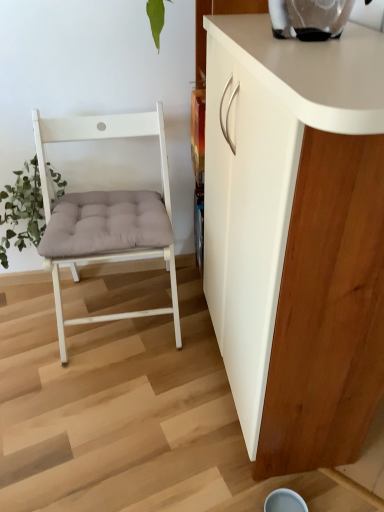
Identify the location of white matte cabinet at right. (296, 237).

From a real-world perspective, is white matte cabinet at right located beneath green fuzzy plant at left?

No, from a real-world perspective, white matte cabinet at right is not below green fuzzy plant at left.

From the image's perspective, who appears lower, white matte cabinet at right or green fuzzy plant at left?

From the image's view, white matte cabinet at right is below.

Which object is further away from the camera, white matte cabinet at right or green fuzzy plant at left?

green fuzzy plant at left.

Would you say white matte cabinet at right is to the left or to the right of green fuzzy plant at left in the picture?

Based on their positions, white matte cabinet at right is located to the right of green fuzzy plant at left.

Can you confirm if white wood chair at left is taller than white matte cabinet at right?

No.

The width and height of the screenshot is (384, 512). Identify the location of chair on the left of white matte cabinet at right. (105, 213).

Between white wood chair at left and white matte cabinet at right, which one is positioned in front?

white matte cabinet at right is closer to the camera.

Which of these two, white wood chair at left or white matte cabinet at right, is smaller?

With smaller size is white wood chair at left.

From their relative heights in the image, would you say white wood chair at left is taller or shorter than green fuzzy plant at left?

white wood chair at left is taller than green fuzzy plant at left.

From the image's perspective, which object appears higher, white wood chair at left or green fuzzy plant at left?

green fuzzy plant at left appears higher in the image.

Is white wood chair at left aimed at green fuzzy plant at left?

No, white wood chair at left does not turn towards green fuzzy plant at left.

The image size is (384, 512). Identify the location of plant behind the white wood chair at left. (22, 210).

Is white matte cabinet at right taller than white wood chair at left?

Yes.

From a real-world perspective, relative to white wood chair at left, is white matte cabinet at right vertically above or below?

white matte cabinet at right is situated higher than white wood chair at left in the real world.

You are a GUI agent. You are given a task and a screenshot of the screen. Output one action in this format:
    pyautogui.click(x=<x>, y=<y>)
    Task: Click on the chair behind the white matte cabinet at right
    
    Given the screenshot: What is the action you would take?
    pyautogui.click(x=105, y=213)

Can you tell me how much white matte cabinet at right and white wood chair at left differ in facing direction?

The facing directions of white matte cabinet at right and white wood chair at left are 91 degrees apart.

Based on their positions, is green fuzzy plant at left located to the left or right of white matte cabinet at right?

green fuzzy plant at left is to the left of white matte cabinet at right.

Is green fuzzy plant at left looking in the opposite direction of white matte cabinet at right?

No, green fuzzy plant at left is not facing the opposite direction of white matte cabinet at right.

Is green fuzzy plant at left not near white matte cabinet at right?

green fuzzy plant at left is actually quite close to white matte cabinet at right.

Looking at this image, in terms of height, does green fuzzy plant at left look taller or shorter compared to white wood chair at left?

Clearly, green fuzzy plant at left is shorter compared to white wood chair at left.

Can white wood chair at left be found inside green fuzzy plant at left?

No, white wood chair at left is not a part of green fuzzy plant at left.

From a real-world perspective, does green fuzzy plant at left stand above white wood chair at left?

No.

What are the coordinates of `plant that is under the white matte cabinet at right (from a real-world perspective)` in the screenshot? It's located at (22, 210).

Where is `cabinetry that is above the white wood chair at left (from a real-world perspective)`? cabinetry that is above the white wood chair at left (from a real-world perspective) is located at coordinates (296, 237).

When comparing their distances from white matte cabinet at right, does green fuzzy plant at left or white wood chair at left seem closer?

white wood chair at left is positioned closer to the anchor white matte cabinet at right.

Which object lies further to the anchor point green fuzzy plant at left, white wood chair at left or white matte cabinet at right?

white matte cabinet at right lies further to green fuzzy plant at left than the other object.

Looking at the image, which one is located closer to green fuzzy plant at left, white matte cabinet at right or white wood chair at left?

white wood chair at left lies closer to green fuzzy plant at left than the other object.

Based on their spatial positions, is white wood chair at left or green fuzzy plant at left further from white matte cabinet at right?

green fuzzy plant at left is further to white matte cabinet at right.

Based on their spatial positions, is white matte cabinet at right or green fuzzy plant at left further from white wood chair at left?

white matte cabinet at right is positioned further to the anchor white wood chair at left.

Estimate the real-world distances between objects in this image. Which object is closer to white wood chair at left, green fuzzy plant at left or white matte cabinet at right?

Among the two, green fuzzy plant at left is located nearer to white wood chair at left.

Image resolution: width=384 pixels, height=512 pixels. What are the coordinates of `chair between green fuzzy plant at left and white matte cabinet at right` in the screenshot? It's located at (105, 213).